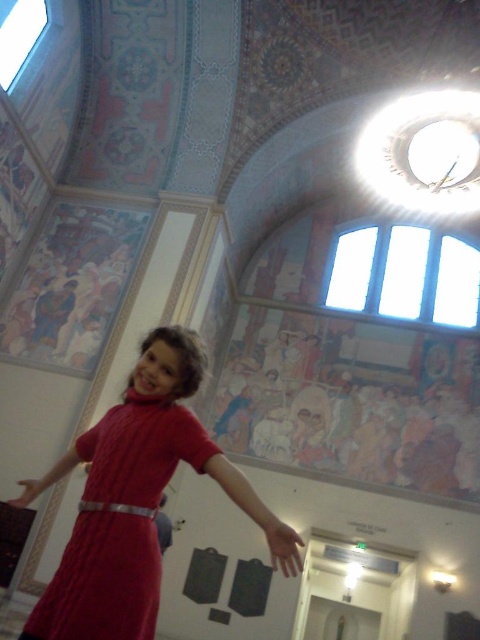
Does cable-knit dress at center appear under white leather belt at center?

Actually, cable-knit dress at center is above white leather belt at center.

Who is more distant from viewer, (x=101, y=632) or (x=84, y=504)?

The point (x=84, y=504) is more distant.

Locate an element on the screen. cable-knit dress at center is located at coordinates (162, 444).